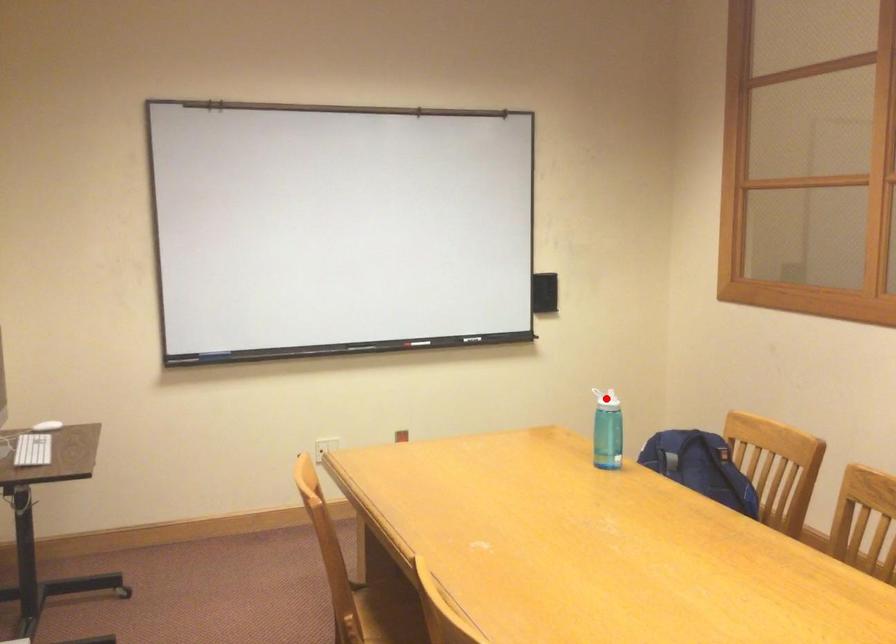
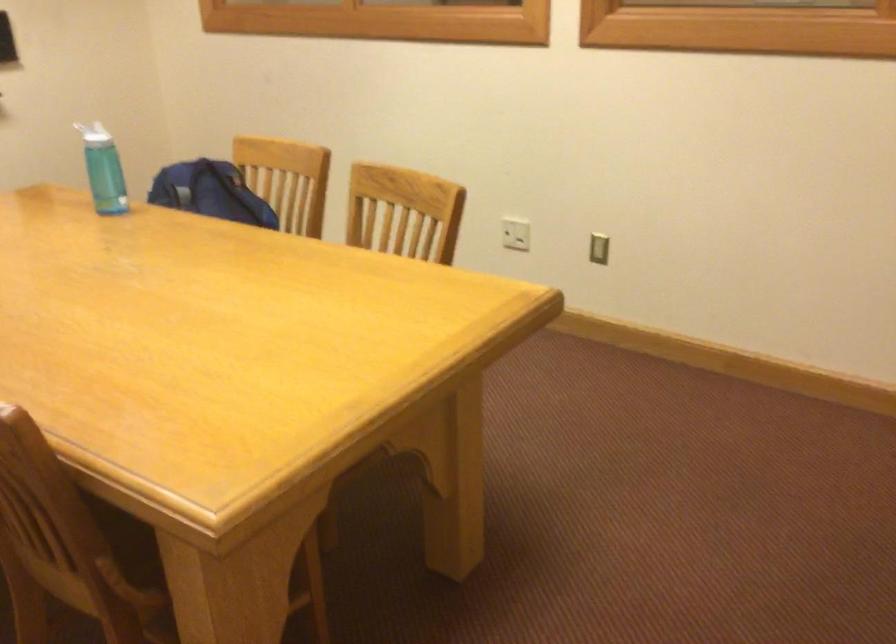
Question: I am providing you with two images of the same scene from different viewpoints. A red point is marked on the first image. Is the red point's position out of view in image 2?

Choices:
 (A) Yes
 (B) No

Answer: (A)